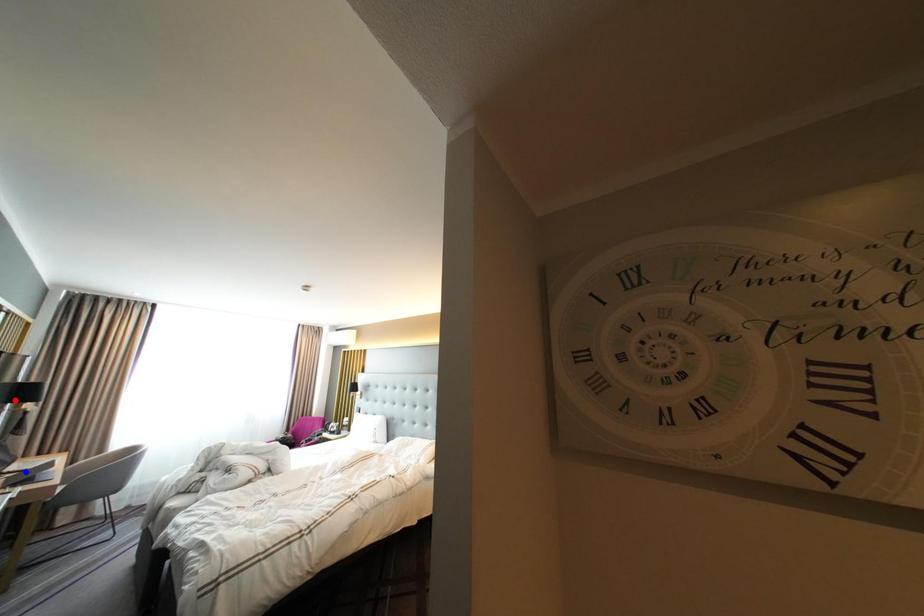
Question: In the image, two points are highlighted. Which point is nearer to the camera? Reply with the corresponding letter.

Choices:
 (A) blue point
 (B) red point

Answer: (A)